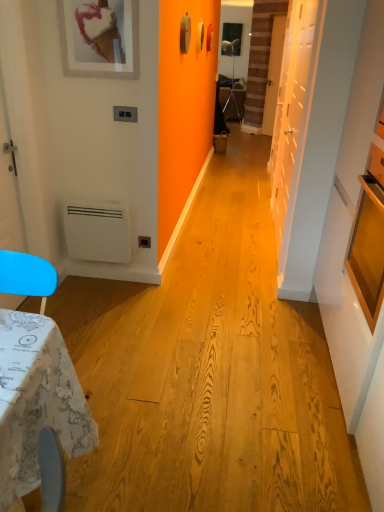
Question: From a real-world perspective, is white matte heater at lower left positioned above or below white matte picture frame at upper left?

Choices:
 (A) above
 (B) below

Answer: (B)

Question: From the image's perspective, is white matte heater at lower left above or below white matte picture frame at upper left?

Choices:
 (A) above
 (B) below

Answer: (B)

Question: Based on their relative distances, which object is farther from the white matte picture frame at upper left?

Choices:
 (A) white matte door at right, placed as the 2th door when sorted from right to left
 (B) matte black tripod at center
 (C) white matte heater at lower left
 (D) wooden door at center, the 2th door positioned from the bottom

Answer: (B)

Question: Which object is the farthest from the wooden door at center, which appears as the first door when viewed from the top?

Choices:
 (A) white matte door at right, positioned as the 1th door in left-to-right order
 (B) white matte heater at lower left
 (C) white matte picture frame at upper left
 (D) matte black tripod at center

Answer: (B)